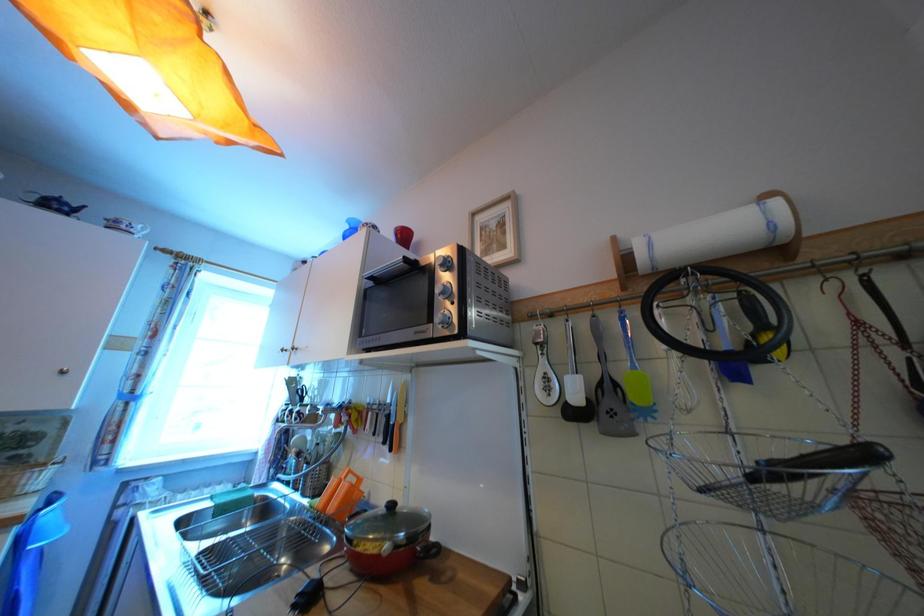
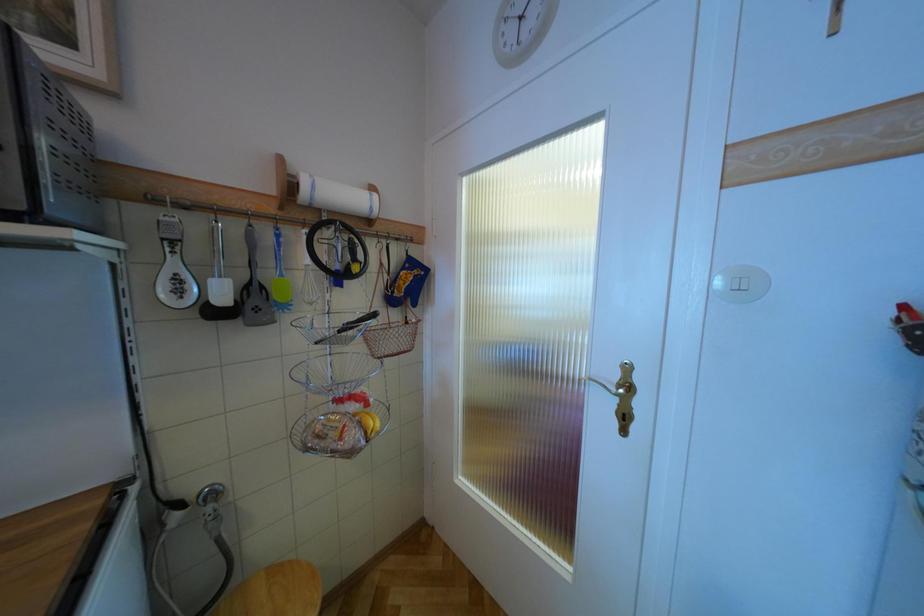
Question: The camera is either moving clockwise (left) or counter-clockwise (right) around the object. The first image is from the beginning of the video and the second image is from the end. Is the camera moving left or right when shooting the video?

Choices:
 (A) Left
 (B) Right

Answer: (A)